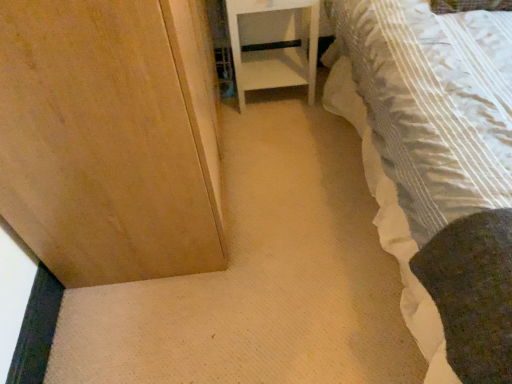
Locate an element on the screen. Image resolution: width=512 pixels, height=384 pixels. vacant area that lies in front of white glossy nightstand at center is located at coordinates (284, 144).